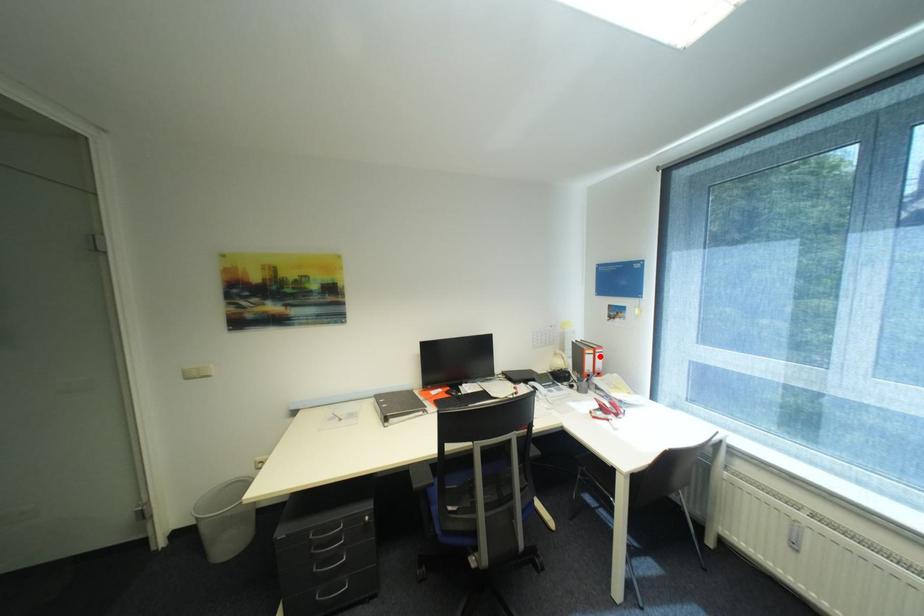
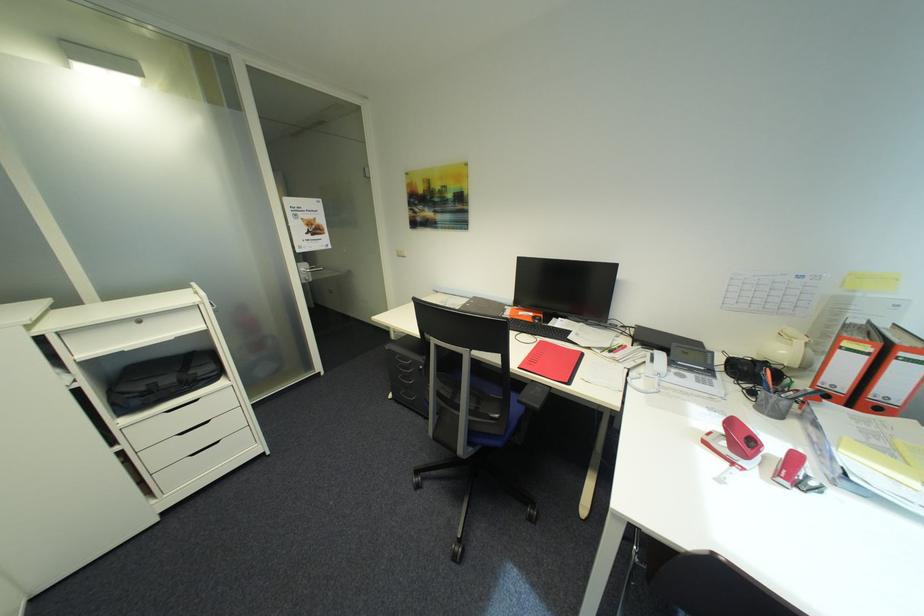
The point at the highlighted location is marked in the first image. Where is the corresponding point in the second image?

(872, 359)